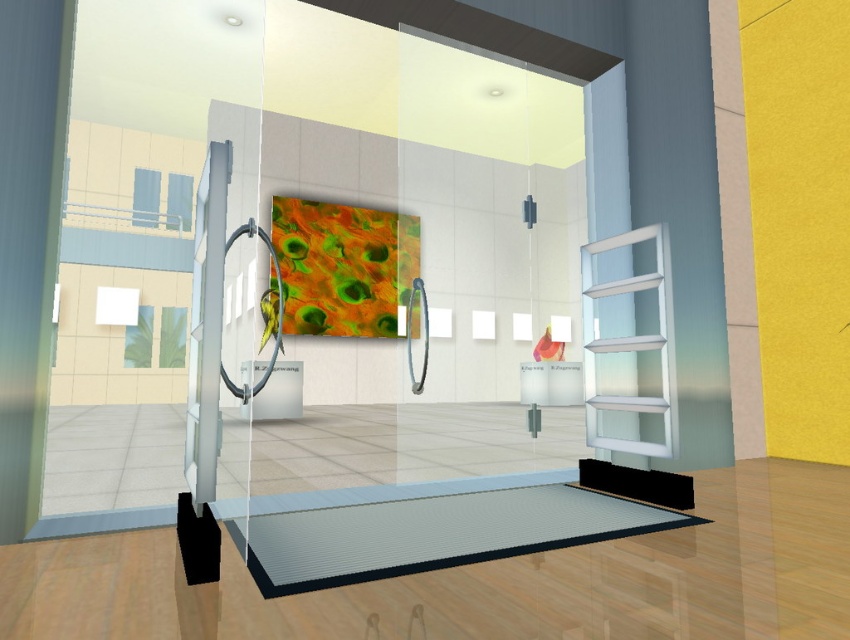
You are standing in the modern gallery space and notice two points marked on the floor. The first point is at coordinates point [664,227] and the second point is at point [630,496]. Which point is closer to the glass partition that separates the entrance from the exhibition area?

Point [664,227] is behind point [630,496], so the second point is closer to the glass partition.

You are an interior designer assessing the space. You notice the metallic gray mat at lower center and the black rubber yoga mat at lower right. Which mat is placed on top of the other?

The metallic gray mat at lower center is positioned over the black rubber yoga mat at lower right.

You are an interior designer planning to place a new piece of furniture in this space. You have a small table that needs to be placed near the transparent frosted glass at right and the black rubber yoga mat at lower right. Based on their positions, where should you position the table to ensure it is between both objects?

The transparent frosted glass at right is located above the black rubber yoga mat at lower right, so positioning the table between them would require placing it below the glass and above the yoga mat, ensuring it sits in the vertical space between both objects.